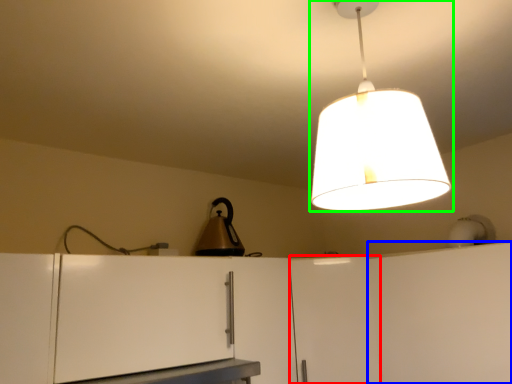
Question: Considering the real-world distances, which object is closest to cabinetry (highlighted by a red box)? cabinetry (highlighted by a blue box) or lamp (highlighted by a green box).

Choices:
 (A) cabinetry
 (B) lamp

Answer: (A)